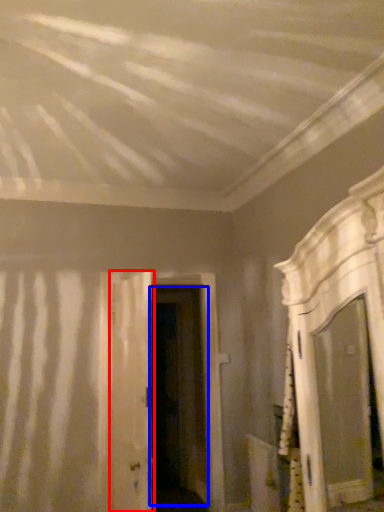
Question: Which of the following is the closest to the observer, door (highlighted by a red box) or door (highlighted by a blue box)?

Choices:
 (A) door
 (B) door

Answer: (A)